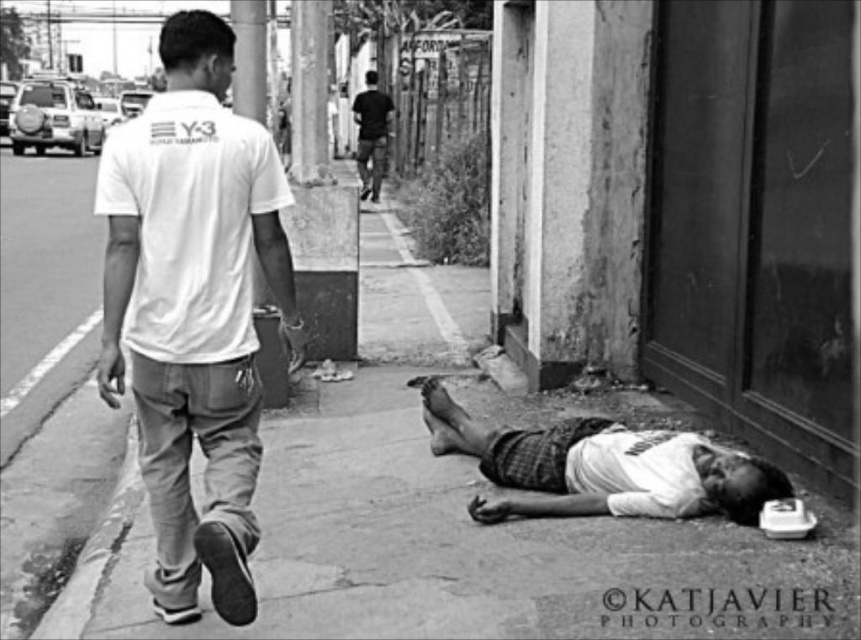
Question: Observing the image, what is the correct spatial positioning of white cotton t-shirt at center in reference to dark clothing figure at center?

Choices:
 (A) right
 (B) left

Answer: (A)

Question: Is white cotton t-shirt at center above dark clothing figure at center?

Choices:
 (A) no
 (B) yes

Answer: (A)

Question: Which of the following is the farthest from the observer?

Choices:
 (A) (383, 161)
 (B) (237, 294)
 (C) (491, 465)

Answer: (A)

Question: Is white cotton shirt at lower right below dark clothing figure at center?

Choices:
 (A) no
 (B) yes

Answer: (B)

Question: Which of the following is the closest to the observer?

Choices:
 (A) (177, 563)
 (B) (562, 449)
 (C) (388, 99)

Answer: (A)

Question: Which object is the farthest from the white cotton shirt at lower right?

Choices:
 (A) dark clothing figure at center
 (B) white cotton t-shirt at center

Answer: (A)